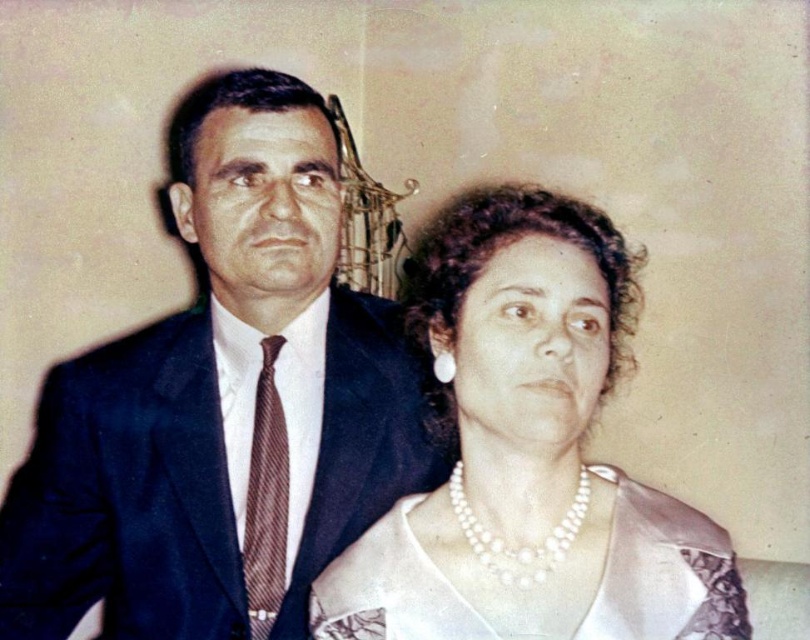
You are a photographer adjusting the lighting for a portrait. You notice the dark blue suit at left and the pearl necklace at upper right. Which object should you focus on first if you want to highlight the larger object in the scene?

The dark blue suit at left is larger in size than the pearl necklace at upper right, so you should focus on the dark blue suit at left first to highlight the larger object.

You are a photographer adjusting the lighting for a portrait. You notice the pearl necklace at upper right and the brown striped tie at left. Which accessory is closer to the camera?

The pearl necklace at upper right is positioned over the brown striped tie at left, so it is closer to the camera.